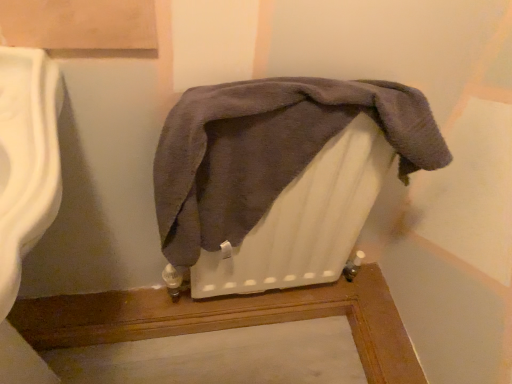
The image size is (512, 384). Describe the element at coordinates (268, 150) in the screenshot. I see `dark gray cotton towel at center` at that location.

At what (x,y) coordinates should I click in order to perform the action: click on dark gray cotton towel at center. Please return your answer as a coordinate pair (x, y). Looking at the image, I should click on (268, 150).

In order to face dark gray cotton towel at center, should I rotate leftwards or rightwards?

You should look right and rotate roughly 5.447 degrees.

The width and height of the screenshot is (512, 384). In order to click on dark gray cotton towel at center in this screenshot , I will do `click(268, 150)`.